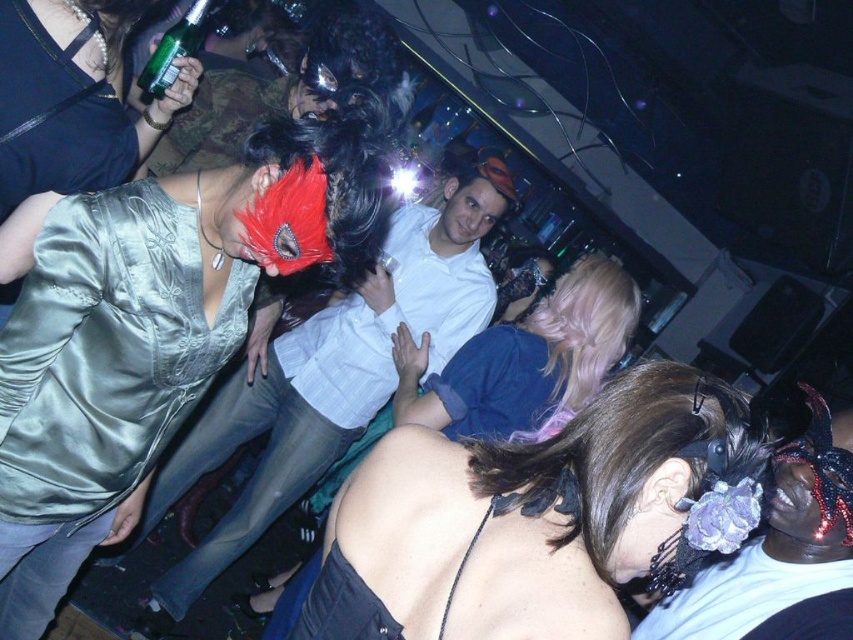
Consider the image. Can you confirm if satin black dress at center is wider than blonde hair at center?

In fact, satin black dress at center might be narrower than blonde hair at center.

Is satin black dress at center smaller than blonde hair at center?

Indeed, satin black dress at center has a smaller size compared to blonde hair at center.

Who is more forward, (476, 593) or (453, 355)?

Point (476, 593) is more forward.

Where is `satin black dress at center`? satin black dress at center is located at coordinates (531, 516).

Who is positioned more to the left, satin mask at upper left or satin black dress at center?

satin mask at upper left

From the picture: Is satin mask at upper left taller than satin black dress at center?

Correct, satin mask at upper left is much taller as satin black dress at center.

Is point (361, 227) positioned in front of point (741, 406)?

No, it is not.

This screenshot has height=640, width=853. I want to click on satin mask at upper left, so click(x=152, y=330).

From the picture: Does satin mask at upper left have a larger size compared to blonde hair at center?

Yes.

Is satin mask at upper left to the right of blonde hair at center from the viewer's perspective?

In fact, satin mask at upper left is to the left of blonde hair at center.

Image resolution: width=853 pixels, height=640 pixels. Identify the location of satin mask at upper left. (152, 330).

At what (x,y) coordinates should I click in order to perform the action: click on satin mask at upper left. Please return your answer as a coordinate pair (x, y). The height and width of the screenshot is (640, 853). Looking at the image, I should click on (152, 330).